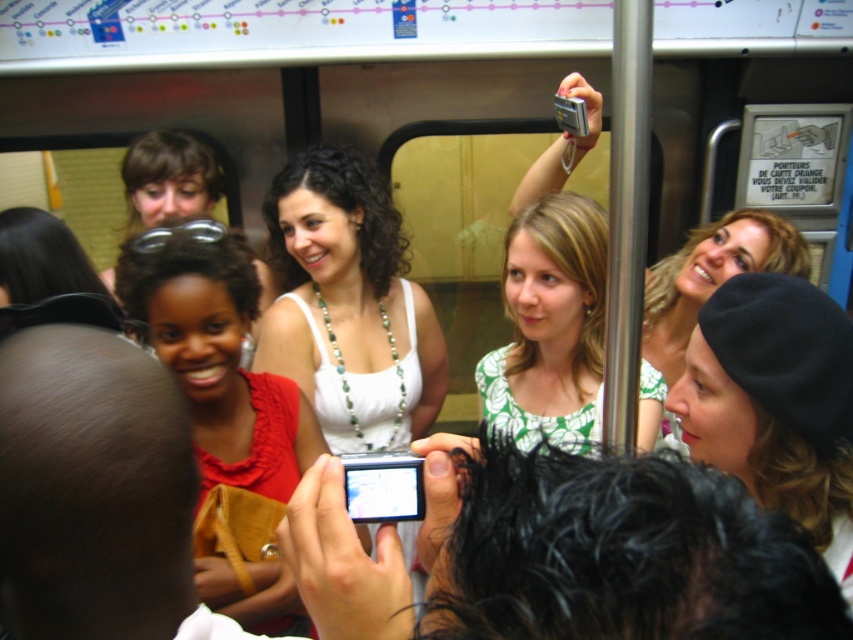
In the subway car scene, there are several people taking photos with their cameras. Among them, a person is holding a digital camera at lower left and another is raising a camera above their head at upper right. You are a photographer who wants to take a picture of the white beaded necklace at center marked by point (347, 305). Which camera position would allow you to capture the necklace without obstruction from the other photographers?

The white beaded necklace at center is marked by point (347, 305). Since the person with the digital camera at lower left and the one raising a camera above their head at upper right are positioned away from the center, using the camera at lower left would provide a clearer shot of the necklace without obstruction from the other photographers.

You are standing inside the subway car and want to take a photo of both the point at coordinates point (387, 237) and the point at coordinates point (547, 401). Since you want to ensure both points are in focus, which point should you focus on first to maintain clarity for both?

You should focus on point (387, 237) first because it is closer to you than point (547, 401). This way, the depth of field will cover both points effectively.

You are a photographer trying to capture the entire group of people in the subway car. You notice the matte red blouse at center and the matte black beanie at upper right. Which clothing item should you focus on to ensure the entire group is in frame?

The matte red blouse at center has a larger width than the matte black beanie at upper right, so focusing on the matte red blouse at center would help ensure the entire group is captured in the frame since it occupies more space.